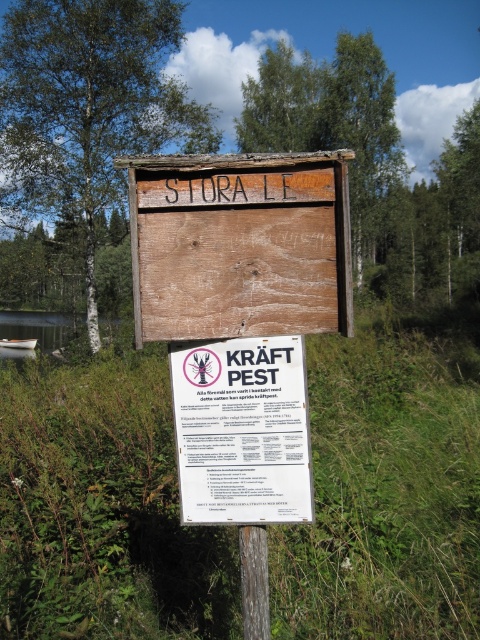
You are an outdoor enthusiast planning to take a photo of the brown wood tree at upper center and the white plastic canoe at left. Which object should you focus on first if you want to capture both in a single frame without moving the camera?

The brown wood tree at upper center is wider than the white plastic canoe at left, so you should focus on the brown wood tree at upper center first to ensure both fit in the frame.

You are standing in front of the scene and want to locate the weathered wood sign at center and the brushed metal water at lower left. Which object is positioned to the left?

The brushed metal water at lower left is positioned to the left of the weathered wood sign at center.

You are standing in front of the wooden signboard and want to place a small flag on the highest object visible in the scene. Which object should you choose between the brown wood tree at upper center and the white plastic canoe at left?

The brown wood tree at upper center is above the white plastic canoe at left, so you should place the flag on the brown wood tree at upper center as it is the highest object.